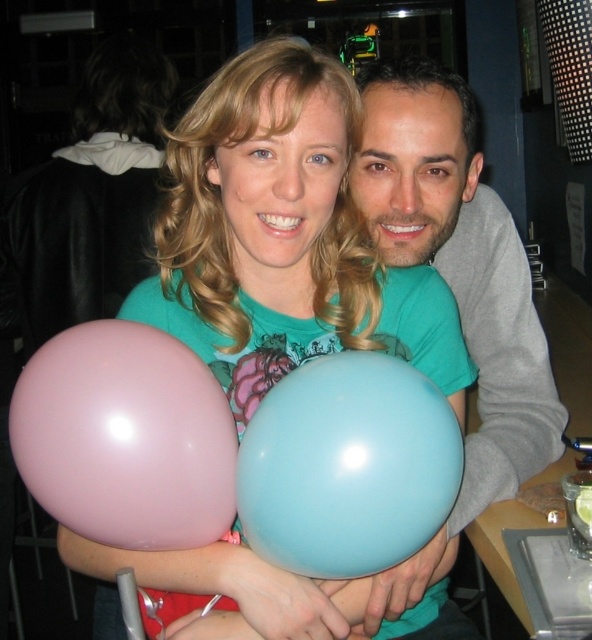
You are planning to decorate a table for a party and need to choose between the pink rubber balloon at left and the light blue rubber balloon at center based on their sizes. Which balloon should you pick if you want the wider one?

The pink rubber balloon at left is wider than the light blue rubber balloon at center, so you should pick the pink rubber balloon at left.

Consider the image. You are at a social event and see the matte rubber balloons at center. If you want to move towards them, which direction should you walk relative to the person on the left with blonde hair?

The matte rubber balloons at center are located at point [284,236], so you should walk towards the center area where the balloons are positioned relative to the person on the left with blonde hair.